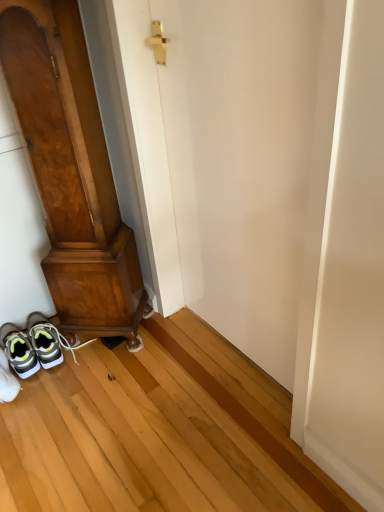
Question: Can we say white smooth door at center, which ranks as the 1th door in right-to-left order, lies outside white matte sneakers at lower left, which is counted as the 1th footwear, starting from the back?

Choices:
 (A) no
 (B) yes

Answer: (B)

Question: Considering the relative sizes of white smooth door at center, which ranks as the 1th door in right-to-left order, and white matte sneakers at lower left, which ranks as the 2th footwear in front-to-back order, in the image provided, is white smooth door at center, which ranks as the 1th door in right-to-left order, taller than white matte sneakers at lower left, which ranks as the 2th footwear in front-to-back order,?

Choices:
 (A) no
 (B) yes

Answer: (B)

Question: Would you consider white smooth door at center, which ranks as the 1th door in right-to-left order, to be distant from white matte sneakers at lower left, which is counted as the 1th footwear, starting from the back?

Choices:
 (A) yes
 (B) no

Answer: (B)

Question: Considering the relative sizes of white smooth door at center, which ranks as the 1th door in right-to-left order, and white matte sneakers at lower left, which is counted as the 1th footwear, starting from the back, in the image provided, is white smooth door at center, which ranks as the 1th door in right-to-left order, bigger than white matte sneakers at lower left, which is counted as the 1th footwear, starting from the back,?

Choices:
 (A) no
 (B) yes

Answer: (B)

Question: Considering the relative positions of white smooth door at center, which ranks as the 2th door in left-to-right order, and white matte sneakers at lower left, which ranks as the 2th footwear in front-to-back order, in the image provided, is white smooth door at center, which ranks as the 2th door in left-to-right order, to the left of white matte sneakers at lower left, which ranks as the 2th footwear in front-to-back order, from the viewer's perspective?

Choices:
 (A) no
 (B) yes

Answer: (A)

Question: From a real-world perspective, is white smooth door at center, which ranks as the 2th door in left-to-right order, below white matte sneakers at lower left, which ranks as the 2th footwear in front-to-back order?

Choices:
 (A) yes
 (B) no

Answer: (B)

Question: From a real-world perspective, is wooden door at left, the second door in the right-to-left sequence, located beneath white mesh sneakers at lower left, marked as the 2th footwear in a back-to-front arrangement?

Choices:
 (A) yes
 (B) no

Answer: (B)

Question: From the image's perspective, is wooden door at left, the first door from the left, located beneath white mesh sneakers at lower left, marked as the 2th footwear in a back-to-front arrangement?

Choices:
 (A) yes
 (B) no

Answer: (B)

Question: From a real-world perspective, is wooden door at left, the first door from the left, physically above white mesh sneakers at lower left, marked as the 1th footwear in a front-to-back arrangement?

Choices:
 (A) yes
 (B) no

Answer: (A)

Question: Does wooden door at left, the first door from the left, have a lesser width compared to white mesh sneakers at lower left, marked as the 1th footwear in a front-to-back arrangement?

Choices:
 (A) yes
 (B) no

Answer: (A)

Question: Is wooden door at left, the second door in the right-to-left sequence, beside white mesh sneakers at lower left, marked as the 1th footwear in a front-to-back arrangement?

Choices:
 (A) yes
 (B) no

Answer: (B)

Question: Could white mesh sneakers at lower left, marked as the 2th footwear in a back-to-front arrangement, be considered to be inside wooden door at left, the second door in the right-to-left sequence?

Choices:
 (A) no
 (B) yes

Answer: (A)

Question: From a real-world perspective, is wooden door at left, the second door in the right-to-left sequence, on white matte sneakers at lower left, which ranks as the 2th footwear in front-to-back order?

Choices:
 (A) yes
 (B) no

Answer: (A)